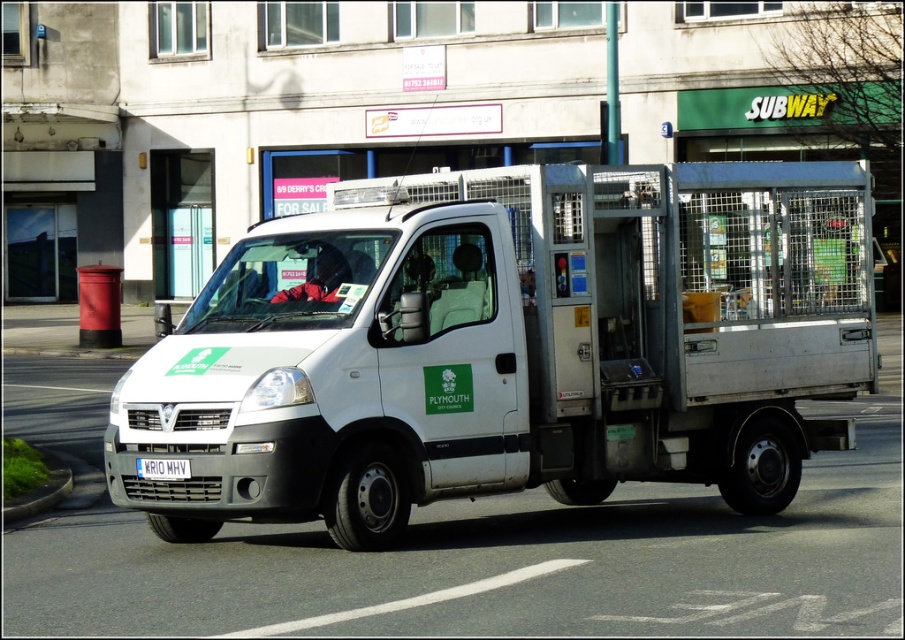
From the picture: You are a delivery driver who needs to park your white matte van at center in a parking spot that can only accommodate vehicles smaller than the van. There is a white metallic license plate at center nearby. Can you park your van in this spot?

The white matte van at center is bigger than the white metallic license plate at center. Since the parking spot can only accommodate vehicles smaller than the van, you cannot park your van there.

You are a delivery driver who needs to park this vehicle under a low clearance bridge. The bridge has a height restriction sign that says 1.8 meters. Knowing that the white metallic license plate at center is 0.2 meters tall, can the white matte van at center pass under the bridge without hitting it?

The white matte van at center is taller than the white metallic license plate at center. Since the license plate is 0.2 meters tall, the van is significantly taller than 1.8 meters. Therefore, the van cannot pass under the bridge without hitting it.

You are a delivery person who needs to park your vehicle in a spot that requires aligning the license plate with the parking sensor. Since the white matte van at center and the white metallic license plate at center are positioned in a certain way, which object should you adjust first to align the license plate correctly?

The white matte van at center is to the right of the white metallic license plate at center, so you should adjust the white matte van at center first to ensure the license plate is properly aligned with the parking sensor.